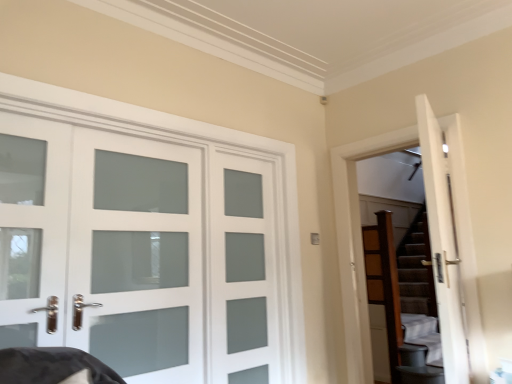
Question: Considering the relative sizes of white frosted glass door at left, marked as the 1th screen door in a left-to-right arrangement, and brown textured stairs at right in the image provided, is white frosted glass door at left, marked as the 1th screen door in a left-to-right arrangement, wider than brown textured stairs at right?

Choices:
 (A) yes
 (B) no

Answer: (B)

Question: Can you confirm if white frosted glass door at left, the second screen door when ordered from right to left, is thinner than brown textured stairs at right?

Choices:
 (A) yes
 (B) no

Answer: (A)

Question: Does white frosted glass door at left, the second screen door when ordered from right to left, contain brown textured stairs at right?

Choices:
 (A) no
 (B) yes

Answer: (A)

Question: Is white frosted glass door at left, the second screen door when ordered from right to left, oriented away from brown textured stairs at right?

Choices:
 (A) yes
 (B) no

Answer: (B)

Question: Is white frosted glass door at left, the second screen door when ordered from right to left, further to camera compared to brown textured stairs at right?

Choices:
 (A) yes
 (B) no

Answer: (B)

Question: Is white frosted glass door at left, marked as the 1th screen door in a left-to-right arrangement, far from brown textured stairs at right?

Choices:
 (A) no
 (B) yes

Answer: (B)

Question: Is white frosted glass door at left, the second screen door when ordered from right to left, smaller than satin glass door at center, which is counted as the second screen door, starting from the left?

Choices:
 (A) no
 (B) yes

Answer: (A)

Question: Is white frosted glass door at left, marked as the 1th screen door in a left-to-right arrangement, closer to the viewer compared to satin glass door at center, which is counted as the second screen door, starting from the left?

Choices:
 (A) yes
 (B) no

Answer: (A)

Question: Is satin glass door at center, which is counted as the second screen door, starting from the left, surrounded by white frosted glass door at left, marked as the 1th screen door in a left-to-right arrangement?

Choices:
 (A) no
 (B) yes

Answer: (A)

Question: From the image's perspective, is white frosted glass door at left, the second screen door when ordered from right to left, located beneath satin glass door at center, which is counted as the 1th screen door, starting from the right?

Choices:
 (A) yes
 (B) no

Answer: (B)

Question: Is white frosted glass door at left, marked as the 1th screen door in a left-to-right arrangement, not inside satin glass door at center, which is counted as the second screen door, starting from the left?

Choices:
 (A) no
 (B) yes

Answer: (B)

Question: Does white frosted glass door at left, the second screen door when ordered from right to left, appear on the left side of satin glass door at center, which is counted as the second screen door, starting from the left?

Choices:
 (A) no
 (B) yes

Answer: (B)

Question: Is white frosted glass door at left positioned in front of white frosted glass door at left, marked as the 1th screen door in a left-to-right arrangement?

Choices:
 (A) no
 (B) yes

Answer: (B)